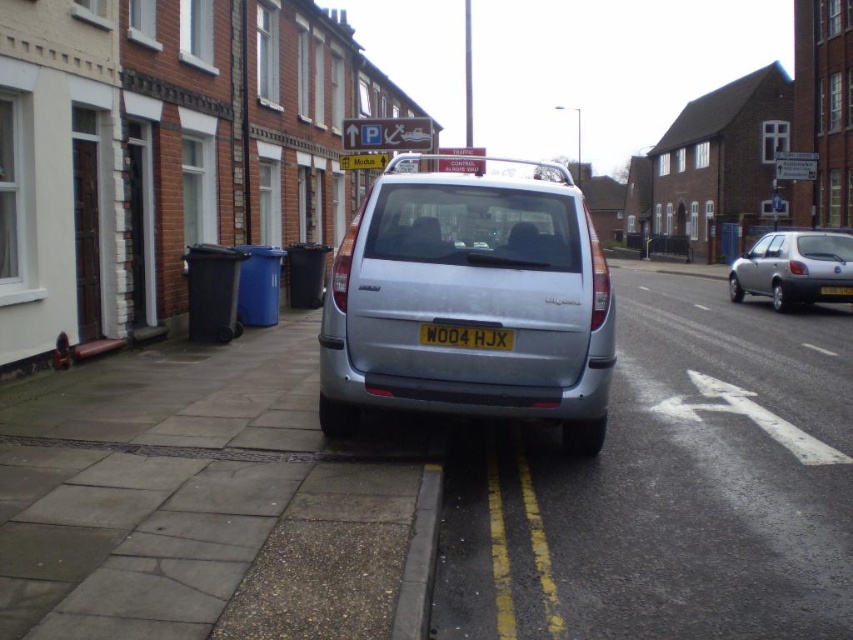
Question: Is silver metallic minivan at center bigger than silver metallic hatchback at right?

Choices:
 (A) no
 (B) yes

Answer: (B)

Question: Can you confirm if silver metallic hatchback at right is thinner than yellow matte license plate at center?

Choices:
 (A) no
 (B) yes

Answer: (A)

Question: Among these points, which one is nearest to the camera?

Choices:
 (A) (844, 288)
 (B) (497, 328)
 (C) (527, 250)
 (D) (851, 273)

Answer: (B)

Question: Is silver metallic minivan at center wider than silver metallic hatchback at right?

Choices:
 (A) yes
 (B) no

Answer: (B)

Question: Which object is positioned closest to the white plastic license plate at center?

Choices:
 (A) silver metallic hatchback at right
 (B) silver metallic minivan at center

Answer: (B)

Question: Among these points, which one is farthest from the camera?

Choices:
 (A) (795, 256)
 (B) (427, 200)

Answer: (A)